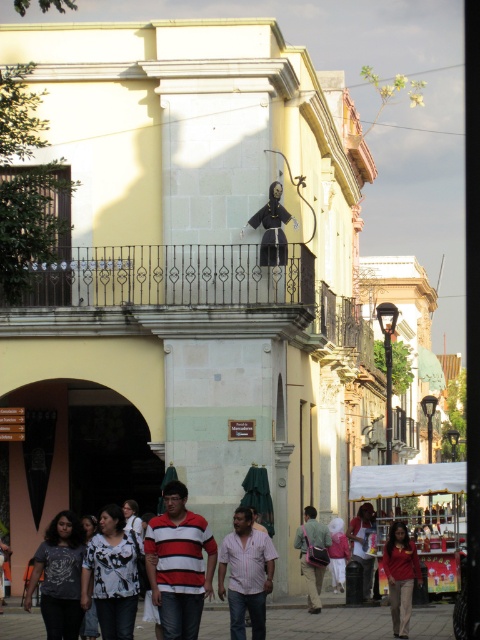
You are a photographer trying to capture a wide shot of the black wrought iron balcony at center and the matte red shirt at center in the same frame. Which object should you focus on first to ensure both fit in the frame?

You should focus on the black wrought iron balcony at center first because its width surpasses that of the matte red shirt at center, ensuring it occupies more space and allowing the smaller object to fit alongside.

From the picture: You are a photographer trying to capture the pink striped shirt at center without the black wrought iron balcony at center blocking the view. Is this possible based on their positions?

The pink striped shirt at center is behind the black wrought iron balcony at center, so it is currently blocked by the balcony. To capture the shirt without the balcony blocking it, you would need to adjust your position or angle to move around the balcony.